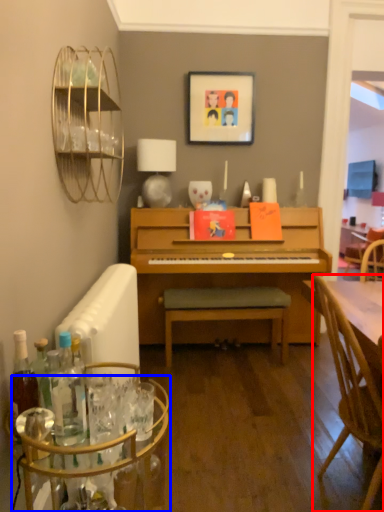
Question: Which of the following is the closest to the observer, chair (highlighted by a red box) or glass table (highlighted by a blue box)?

Choices:
 (A) chair
 (B) glass table

Answer: (B)